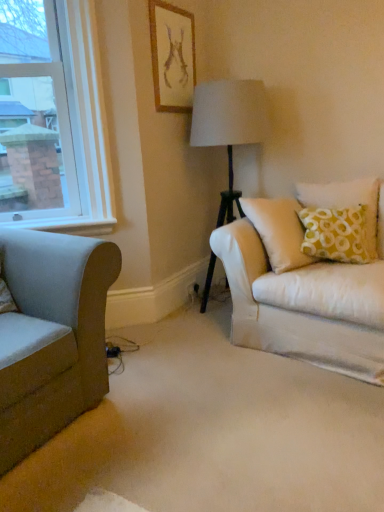
Where is `vacant space to the right of velvet green couch at left`? This screenshot has height=512, width=384. vacant space to the right of velvet green couch at left is located at coordinates (181, 396).